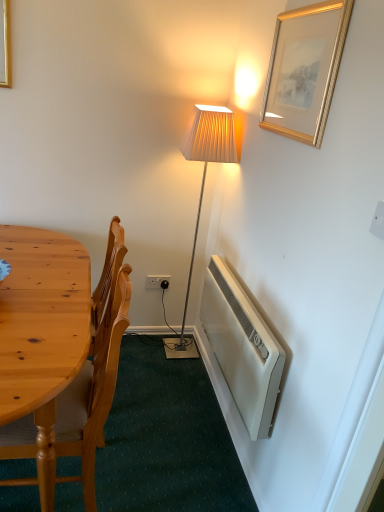
Question: Would you say white plastic power outlet at lower center is to the left or to the right of wooden chair at left in the picture?

Choices:
 (A) left
 (B) right

Answer: (B)

Question: Is white plastic power outlet at lower center inside the boundaries of wooden chair at left, or outside?

Choices:
 (A) outside
 (B) inside

Answer: (A)

Question: Which object is positioned farthest from the white plastic power outlet at lower center?

Choices:
 (A) white plastic radiator at lower right
 (B) gold/gilded picture frame at upper right
 (C) wooden chair at left

Answer: (B)

Question: Considering the real-world distances, which object is closest to the white plastic power outlet at lower center?

Choices:
 (A) gold/gilded picture frame at upper right
 (B) wooden chair at left
 (C) white plastic radiator at lower right

Answer: (C)